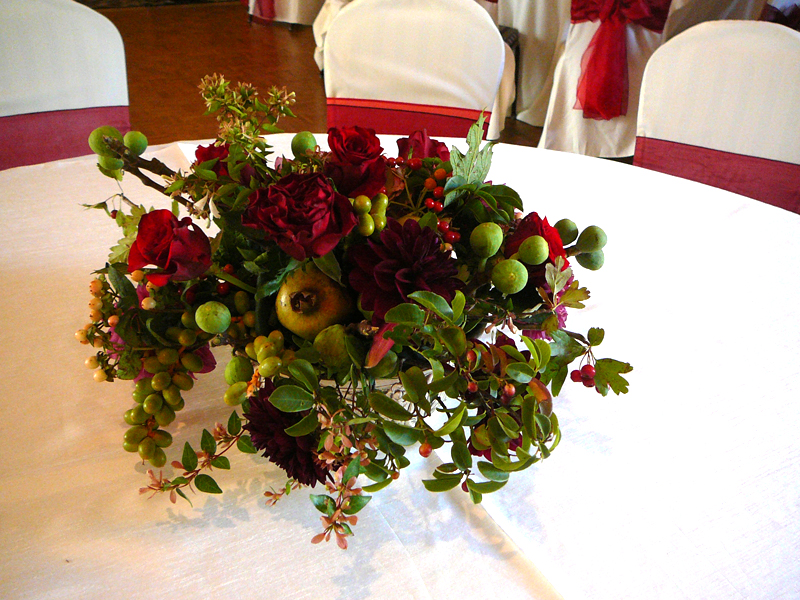
In order to click on plant in this screenshot , I will do `click(361, 278)`.